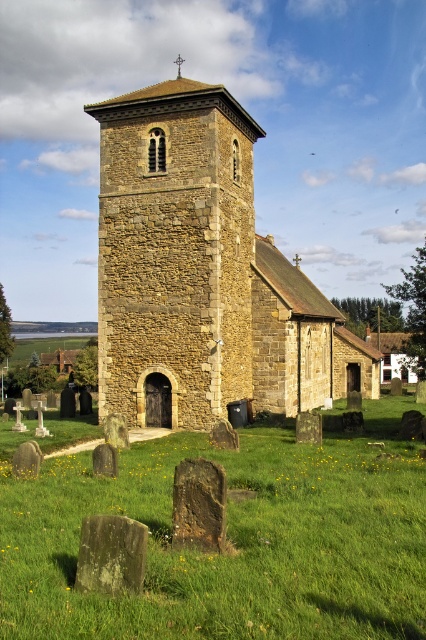
Question: Can you confirm if green grassy at center is positioned below dark brown stone gravestone at lower center?

Choices:
 (A) no
 (B) yes

Answer: (B)

Question: Estimate the real-world distances between objects in this image. Which object is closer to the brown stone church at center?

Choices:
 (A) dark brown stone gravestone at lower center
 (B) green grassy at center

Answer: (B)

Question: Can you confirm if green grassy at center is thinner than dark gray stone gravestone at lower left?

Choices:
 (A) no
 (B) yes

Answer: (A)

Question: Is dark gray stone gravestone at lower left thinner than dark brown stone gravestone at lower center?

Choices:
 (A) yes
 (B) no

Answer: (B)

Question: Which point appears closest to the camera in this image?

Choices:
 (A) (48, 531)
 (B) (195, 500)
 (C) (262, 301)

Answer: (B)

Question: Which of the following is the farthest from the observer?

Choices:
 (A) (187, 524)
 (B) (26, 548)
 (C) (132, 381)
 (D) (111, 528)

Answer: (C)